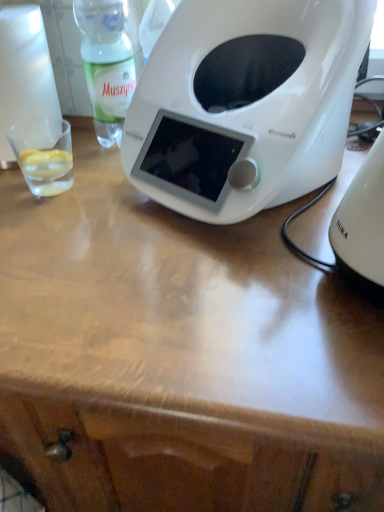
Question: Relative to green translucent bottle at upper left, is white paper towel at left in front or behind?

Choices:
 (A) behind
 (B) front

Answer: (B)

Question: Is point (6, 67) closer or farther from the camera than point (94, 62)?

Choices:
 (A) closer
 (B) farther

Answer: (A)

Question: Based on their relative distances, which object is farther from the transparent glass at left?

Choices:
 (A) white plastic toaster at center
 (B) white plastic kettle at right
 (C) white paper towel at left
 (D) green translucent bottle at upper left

Answer: (B)

Question: Which object is the farthest from the transparent glass at left?

Choices:
 (A) white paper towel at left
 (B) white plastic kettle at right
 (C) white plastic toaster at center
 (D) green translucent bottle at upper left

Answer: (B)